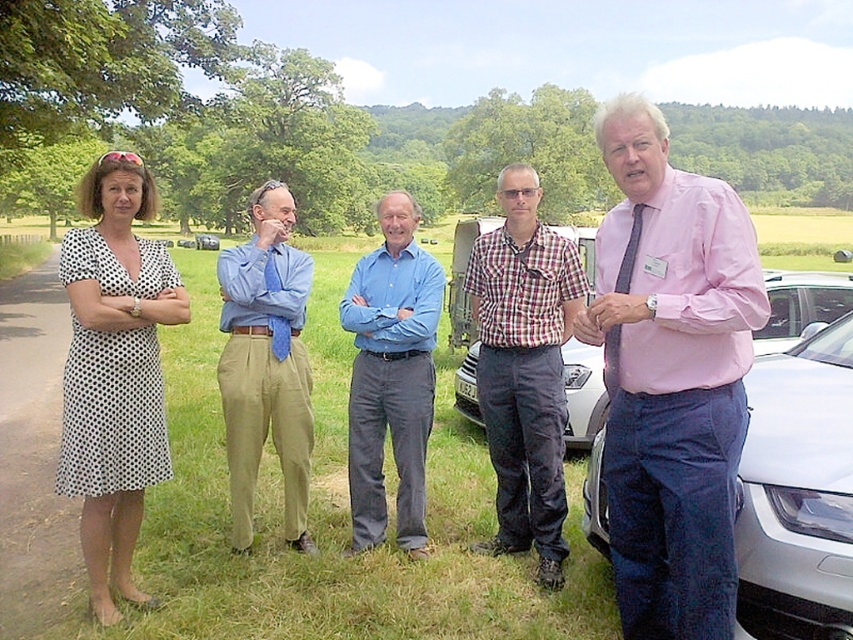
Question: Does white dotted dress at left appear on the left side of plaid shirt at center?

Choices:
 (A) no
 (B) yes

Answer: (B)

Question: From the image, what is the correct spatial relationship of white dotted dress at left in relation to metallic silver car at center?

Choices:
 (A) right
 (B) left

Answer: (A)

Question: Which object is the closest to the pink shirt at center?

Choices:
 (A) white dotted dress at left
 (B) metallic silver car at center
 (C) blue tie at center
 (D) plaid shirt at center

Answer: (D)

Question: Which is farther from the pink shirt at center?

Choices:
 (A) white glossy car at right
 (B) white dotted dress at left
 (C) blue tie at center

Answer: (B)

Question: Does white metallic car at right come in front of metallic silver car at center?

Choices:
 (A) yes
 (B) no

Answer: (A)

Question: Which point is closer to the camera?

Choices:
 (A) (397, 196)
 (B) (775, 310)
 (C) (759, 465)
 (D) (488, 380)

Answer: (C)